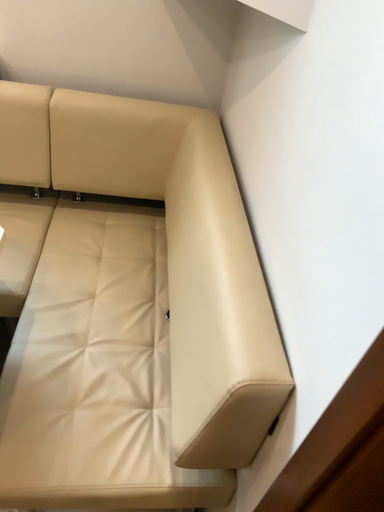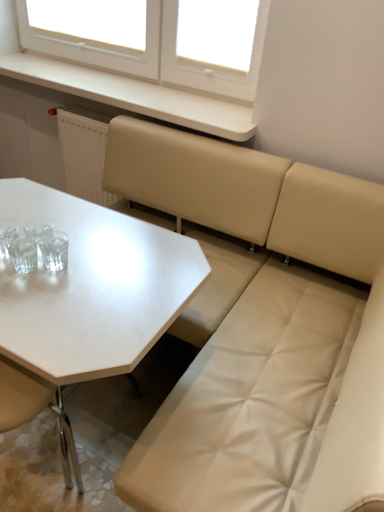
Question: How did the camera likely rotate when shooting the video?

Choices:
 (A) rotated downward
 (B) rotated upward

Answer: (B)